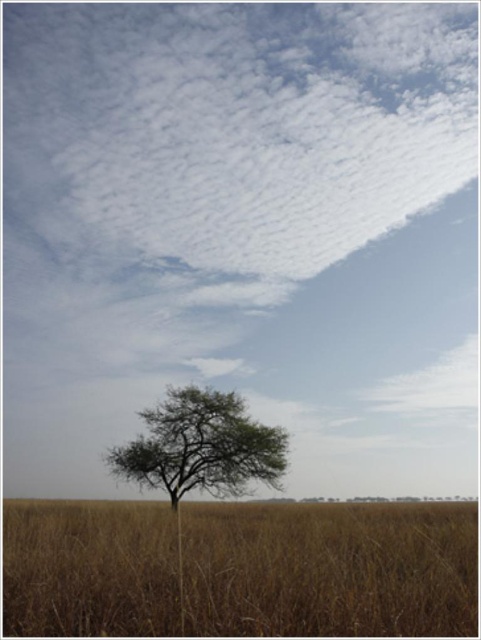
Question: Which point is closer to the camera?

Choices:
 (A) brown dry grass at lower center
 (B) green leafy tree at center

Answer: (A)

Question: Does brown dry grass at lower center appear under green leafy tree at center?

Choices:
 (A) no
 (B) yes

Answer: (B)

Question: Does brown dry grass at lower center lie behind green leafy tree at center?

Choices:
 (A) no
 (B) yes

Answer: (A)

Question: Can you confirm if brown dry grass at lower center is thinner than green leafy tree at center?

Choices:
 (A) no
 (B) yes

Answer: (A)